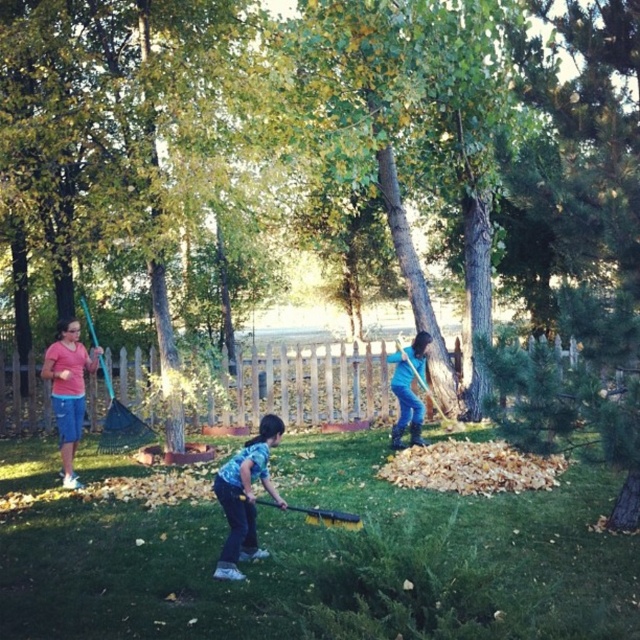
You are helping to clean up the backyard and need to choose a tool to gather leaves. Which tool is shorter between the yellow plastic brush at lower center and the wooden shovel at right?

The yellow plastic brush at lower center is shorter than the wooden shovel at right, so you should choose the yellow plastic brush at lower center for gathering leaves if you prefer a shorter tool.

You are standing in the backyard and want to pick up the yellow plastic brush at lower center. However, the wooden shovel at right is blocking your path. Can you reach the brush without moving the shovel?

The yellow plastic brush at lower center is positioned under the wooden shovel at right, so you can still reach it without moving the shovel since it is underneath.